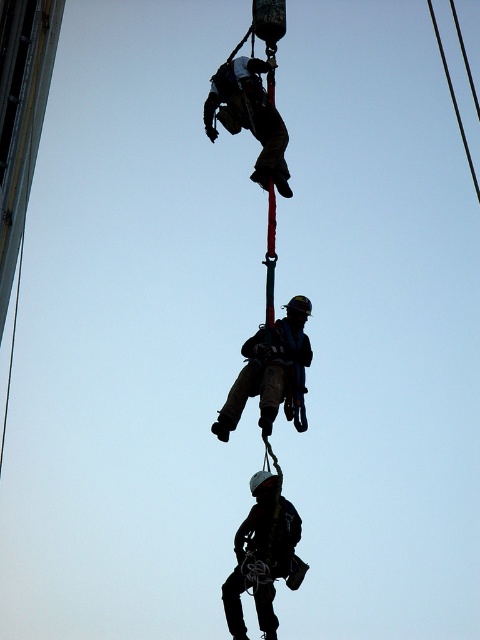
You are a safety inspector reviewing the rappelling setup. You notice two helmets labeled as black matte helmet at center and matte black helmet at center. Which helmet takes up more space in the image?

The matte black helmet at center takes up more space in the image than the black matte helmet at center.

You are a safety inspector reviewing the rappelling setup. You notice two critical components in the middle section of the rope system. The first is the matte black helmet at center, and the second is the matte black harness at upper center. Based on their positions, which component is located to the right of the other?

The matte black helmet at center is positioned on the right side of the matte black harness at upper center.